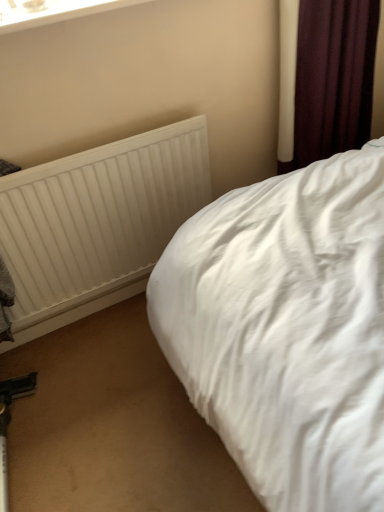
Question: From the image's perspective, is dark purple fabric at upper right located beneath white textured radiator at upper left?

Choices:
 (A) no
 (B) yes

Answer: (A)

Question: Is the surface of dark purple fabric at upper right in direct contact with white textured radiator at upper left?

Choices:
 (A) no
 (B) yes

Answer: (A)

Question: From a real-world perspective, is dark purple fabric at upper right on white textured radiator at upper left?

Choices:
 (A) no
 (B) yes

Answer: (B)

Question: Can white textured radiator at upper left be found inside dark purple fabric at upper right?

Choices:
 (A) yes
 (B) no

Answer: (B)

Question: Can you confirm if dark purple fabric at upper right is thinner than white textured radiator at upper left?

Choices:
 (A) yes
 (B) no

Answer: (B)

Question: Does dark purple fabric at upper right have a lesser height compared to white textured radiator at upper left?

Choices:
 (A) no
 (B) yes

Answer: (A)

Question: Is white cotton bed at center smaller than white textured radiator at upper left?

Choices:
 (A) no
 (B) yes

Answer: (A)

Question: Is white cotton bed at center shorter than white textured radiator at upper left?

Choices:
 (A) yes
 (B) no

Answer: (B)

Question: Is the position of white cotton bed at center more distant than that of white textured radiator at upper left?

Choices:
 (A) no
 (B) yes

Answer: (A)

Question: Does white cotton bed at center have a greater width compared to white textured radiator at upper left?

Choices:
 (A) no
 (B) yes

Answer: (B)

Question: Does white cotton bed at center have a lesser width compared to white textured radiator at upper left?

Choices:
 (A) yes
 (B) no

Answer: (B)

Question: Is white textured radiator at upper left at the back of white cotton bed at center?

Choices:
 (A) no
 (B) yes

Answer: (A)

Question: Considering the relative positions of dark purple fabric at upper right and white plastic window frame at upper left in the image provided, is dark purple fabric at upper right behind white plastic window frame at upper left?

Choices:
 (A) no
 (B) yes

Answer: (B)